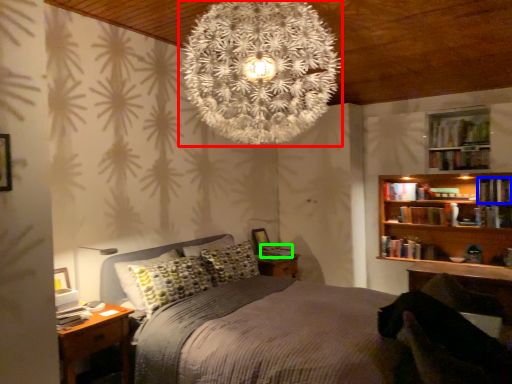
Question: Which is farther away from christmas light (highlighted by a red box)? book (highlighted by a blue box) or book (highlighted by a green box)?

Choices:
 (A) book
 (B) book

Answer: (A)